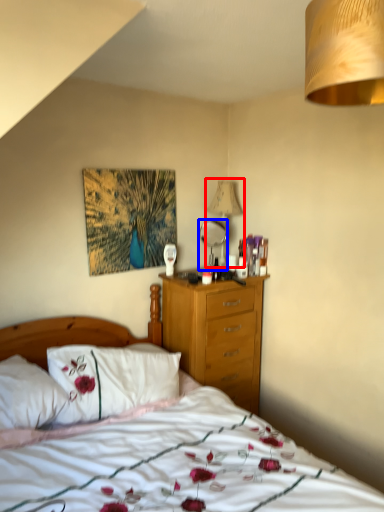
Question: Which point is further to the camera, lamp (highlighted by a red box) or mirror (highlighted by a blue box)?

Choices:
 (A) lamp
 (B) mirror

Answer: (A)